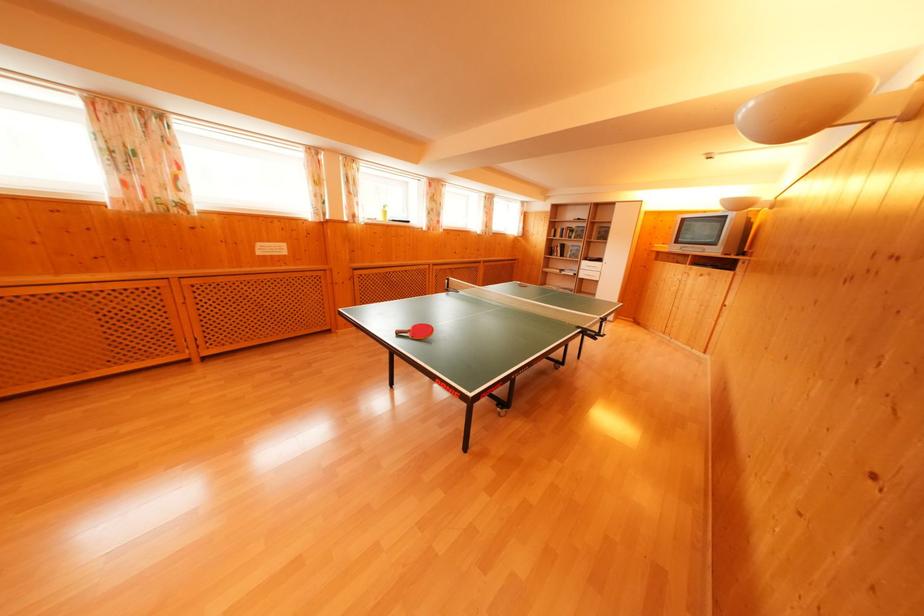
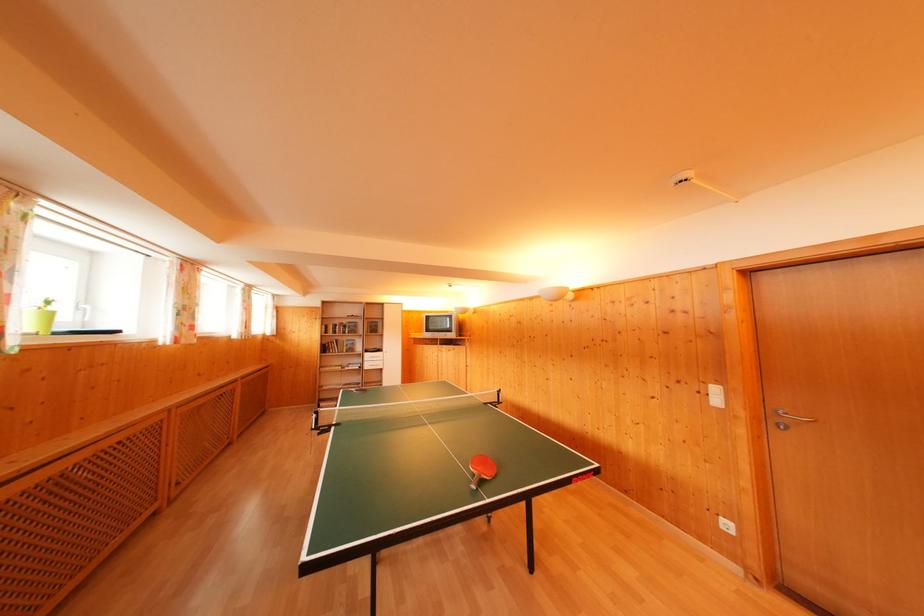
Find the pixel in the second image that matches (x=578, y=231) in the first image.

(349, 326)